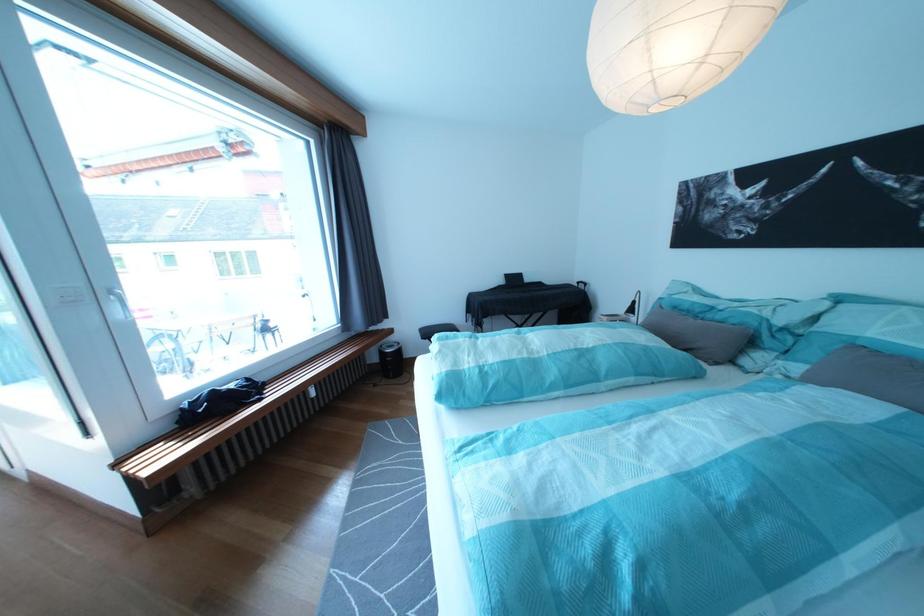
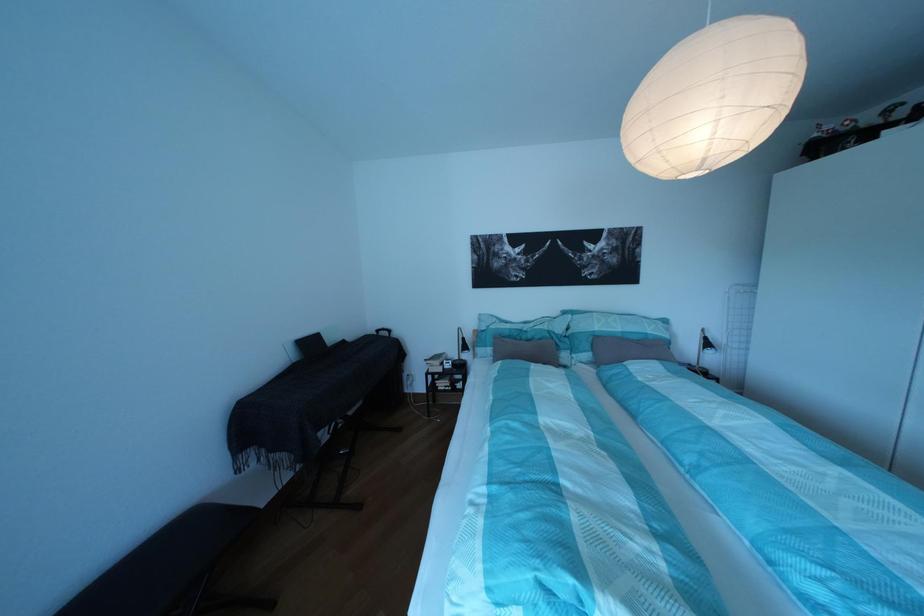
In the second image, find the point that corresponds to the point at 841,309 in the first image.

(582, 322)